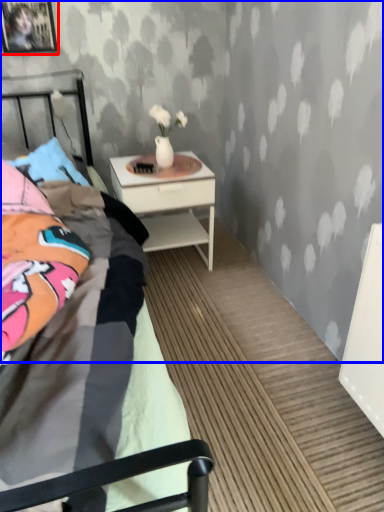
Question: Which object is further to the camera taking this photo, picture frame (highlighted by a red box) or backdrop (highlighted by a blue box)?

Choices:
 (A) picture frame
 (B) backdrop

Answer: (A)